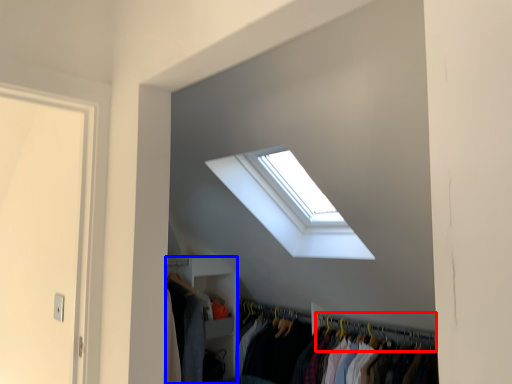
Question: Among these objects, which one is farthest to the camera, hanger (highlighted by a red box) or closet (highlighted by a blue box)?

Choices:
 (A) hanger
 (B) closet

Answer: (B)